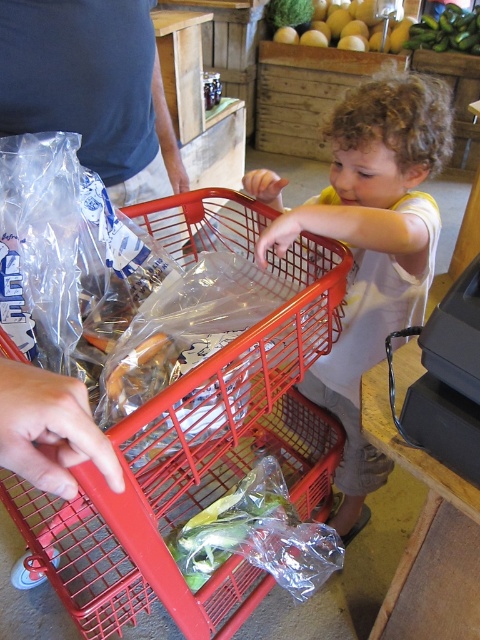
Question: Which point is farther from the camera taking this photo?

Choices:
 (A) (120, 570)
 (B) (416, 49)
 (C) (252, 512)

Answer: (B)

Question: Is red plastic shopping cart at center to the left of green matte zucchini at upper right from the viewer's perspective?

Choices:
 (A) no
 (B) yes

Answer: (B)

Question: Which point is closer to the camera?

Choices:
 (A) green leafy vegetables at center
 (B) curly-haired toddler at center

Answer: (B)

Question: Which of these objects is positioned farthest from the curly-haired toddler at center?

Choices:
 (A) yellow smooth melon at center
 (B) green matte zucchini at upper right
 (C) green leafy vegetables at center

Answer: (A)

Question: Is red plastic shopping cart at center further to the viewer compared to green leafy vegetables at center?

Choices:
 (A) yes
 (B) no

Answer: (B)

Question: Is curly-haired toddler at center below green leafy vegetables at center?

Choices:
 (A) no
 (B) yes

Answer: (A)